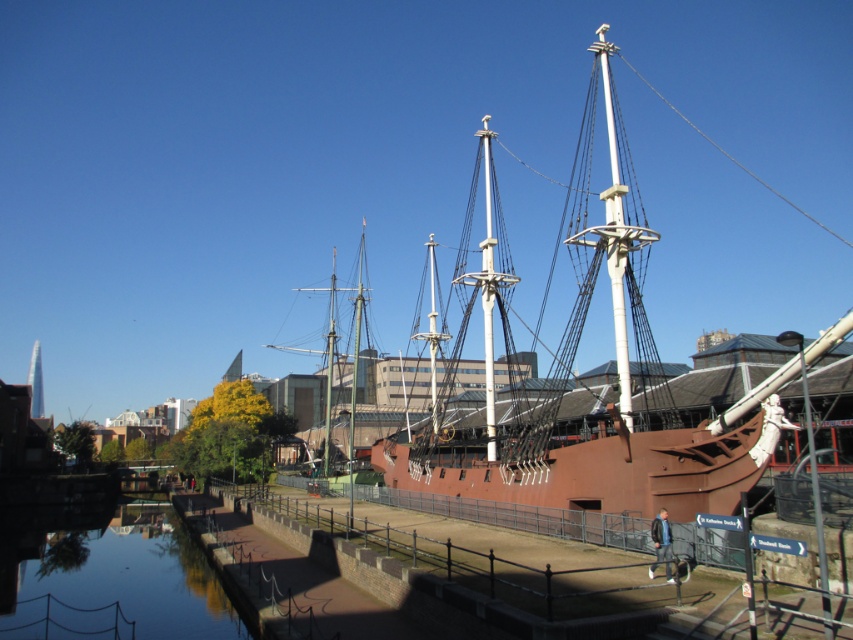
Between smooth water at lower left and rustic wood mast at center, which one is positioned lower?

smooth water at lower left

Can you confirm if smooth water at lower left is positioned above rustic wood mast at center?

Actually, smooth water at lower left is below rustic wood mast at center.

Measure the distance between smooth water at lower left and camera.

smooth water at lower left is 182.99 feet away from camera.

At what (x,y) coordinates should I click in order to perform the action: click on smooth water at lower left. Please return your answer as a coordinate pair (x, y). Looking at the image, I should click on (117, 582).

Which is below, brown wooden ship at center or smooth water at lower left?

smooth water at lower left is below.

Is brown wooden ship at center thinner than smooth water at lower left?

No, brown wooden ship at center is not thinner than smooth water at lower left.

Is point (497, 497) closer to viewer compared to point (189, 563)?

Yes, point (497, 497) is closer to viewer.

Find the location of a particular element. The width and height of the screenshot is (853, 640). brown wooden ship at center is located at coordinates (616, 419).

Based on the photo, is brown wooden ship at center to the right of rustic wood mast at center from the viewer's perspective?

Yes, brown wooden ship at center is to the right of rustic wood mast at center.

What do you see at coordinates (616, 419) in the screenshot? I see `brown wooden ship at center` at bounding box center [616, 419].

Is point (838, 332) positioned after point (328, 356)?

No, it is in front of (328, 356).

The height and width of the screenshot is (640, 853). What are the coordinates of `brown wooden ship at center` in the screenshot? It's located at (616, 419).